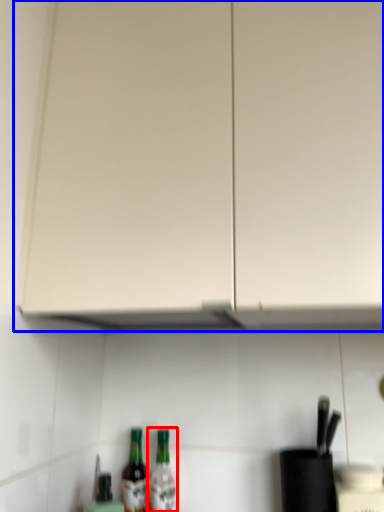
Question: Which object appears farthest to the camera in this image, bottle (highlighted by a red box) or cabinetry (highlighted by a blue box)?

Choices:
 (A) bottle
 (B) cabinetry

Answer: (A)